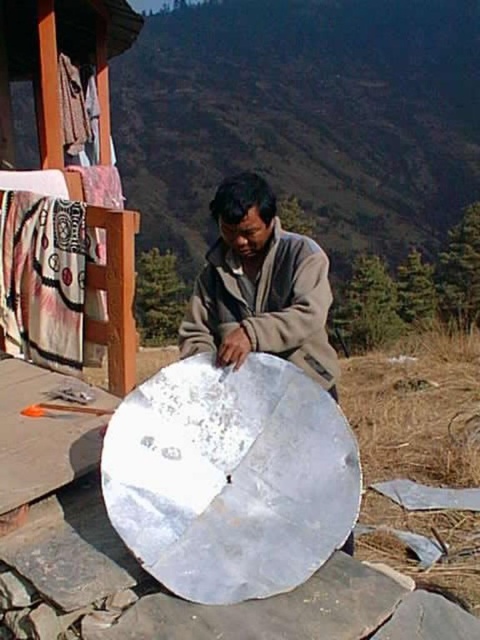
Question: Among these objects, which one is nearest to the camera?

Choices:
 (A) matte gray jacket at center
 (B) white woven cloth at upper left

Answer: (A)

Question: Is matte gray jacket at center further to the viewer compared to white woven cloth at upper left?

Choices:
 (A) no
 (B) yes

Answer: (A)

Question: Can you confirm if matte gray jacket at center is smaller than white woven cloth at upper left?

Choices:
 (A) no
 (B) yes

Answer: (A)

Question: Which of the following is the farthest from the observer?

Choices:
 (A) (13, 216)
 (B) (239, 256)

Answer: (A)

Question: Which point appears closest to the camera in this image?

Choices:
 (A) (303, 369)
 (B) (61, 365)

Answer: (A)

Question: Where is matte gray jacket at center located in relation to white woven cloth at upper left in the image?

Choices:
 (A) below
 (B) above

Answer: (A)